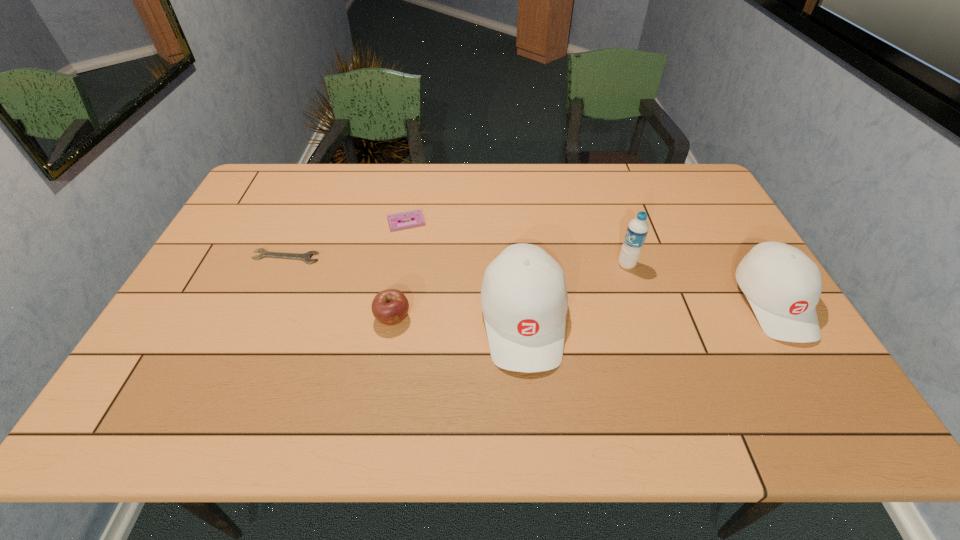
Identify the location of free space that satisfies the following two spatial constraints: 1. on the label of the water bottle; 2. on the front-facing side of the left baseball cap. (644, 320).